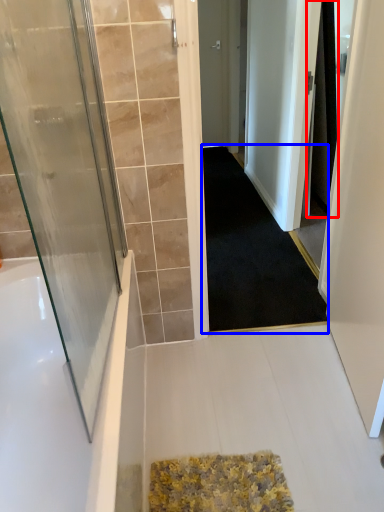
Question: Which object appears closest to the camera in this image, shower curtain (highlighted by a red box) or doormat (highlighted by a blue box)?

Choices:
 (A) shower curtain
 (B) doormat

Answer: (B)